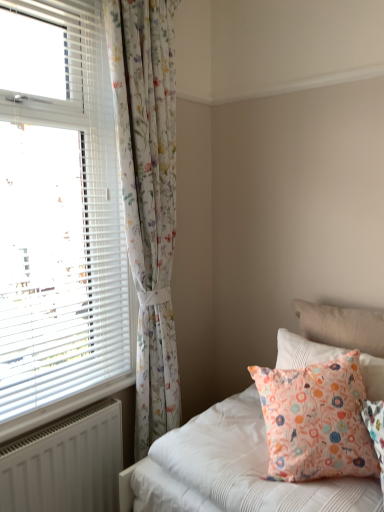
Question: Does white matte radiator at lower left have a greater height compared to white plastic blinds at left?

Choices:
 (A) yes
 (B) no

Answer: (B)

Question: Considering the relative sizes of white matte radiator at lower left and white plastic blinds at left in the image provided, is white matte radiator at lower left shorter than white plastic blinds at left?

Choices:
 (A) yes
 (B) no

Answer: (A)

Question: Is white matte radiator at lower left bigger than white plastic blinds at left?

Choices:
 (A) no
 (B) yes

Answer: (A)

Question: Considering the relative positions of white matte radiator at lower left and white plastic blinds at left in the image provided, is white matte radiator at lower left to the right of white plastic blinds at left from the viewer's perspective?

Choices:
 (A) yes
 (B) no

Answer: (A)

Question: Does white matte radiator at lower left contain white plastic blinds at left?

Choices:
 (A) no
 (B) yes

Answer: (A)

Question: From a real-world perspective, is white matte radiator at lower left on top of white plastic blinds at left?

Choices:
 (A) no
 (B) yes

Answer: (A)

Question: From the image's perspective, is white plastic radiator at lower left located beneath floral fabric pillow at upper right, the first pillow viewed from the back?

Choices:
 (A) no
 (B) yes

Answer: (B)

Question: Is white plastic radiator at lower left to the left of floral fabric pillow at upper right, the first pillow viewed from the back, from the viewer's perspective?

Choices:
 (A) yes
 (B) no

Answer: (A)

Question: Can you confirm if white plastic radiator at lower left is shorter than floral fabric pillow at upper right, which is counted as the 2th pillow, starting from the front?

Choices:
 (A) no
 (B) yes

Answer: (B)

Question: Can you confirm if white plastic radiator at lower left is positioned to the right of floral fabric pillow at upper right, which is counted as the 2th pillow, starting from the front?

Choices:
 (A) no
 (B) yes

Answer: (A)

Question: Is there a large distance between white plastic radiator at lower left and floral fabric pillow at upper right, which is counted as the 2th pillow, starting from the front?

Choices:
 (A) no
 (B) yes

Answer: (A)

Question: Does white plastic radiator at lower left turn towards floral fabric pillow at upper right, which is counted as the 2th pillow, starting from the front?

Choices:
 (A) yes
 (B) no

Answer: (B)

Question: From a real-world perspective, is white plastic blinds at left located beneath floral fabric pillow at upper right, the first pillow viewed from the back?

Choices:
 (A) no
 (B) yes

Answer: (A)